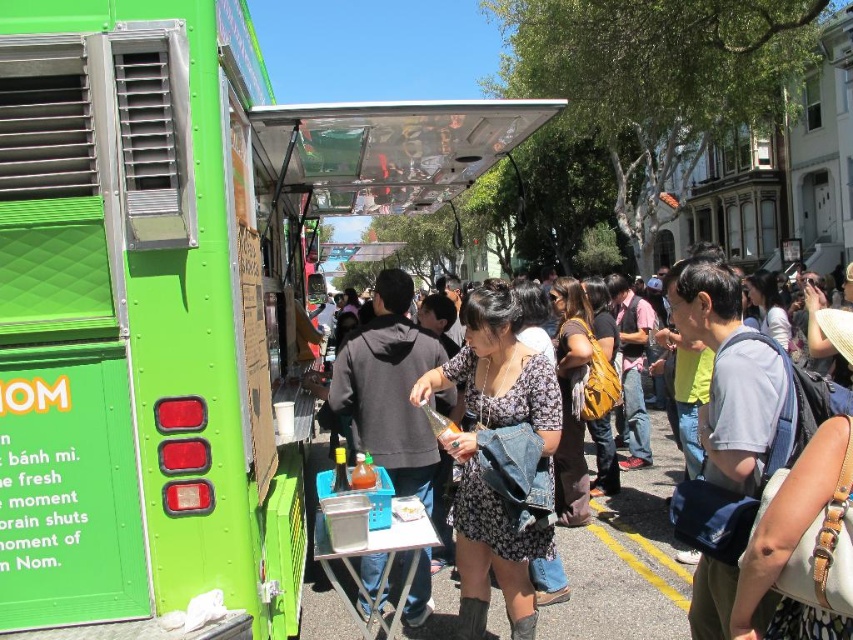
Question: Estimate the real-world distances between objects in this image. Which object is closer to the yellow painted line at lower center?

Choices:
 (A) floral-patterned dress at center
 (B) dark gray hoodie at center
 (C) green matte food truck at center
 (D) denim jacket at center

Answer: (D)

Question: Is floral-patterned dress at center in front of yellow painted line at lower center?

Choices:
 (A) yes
 (B) no

Answer: (A)

Question: Which is farther from the denim jacket at center?

Choices:
 (A) yellow painted line at lower center
 (B) floral-patterned dress at center

Answer: (B)

Question: Does denim jacket at center come in front of dark gray hoodie at center?

Choices:
 (A) yes
 (B) no

Answer: (B)

Question: Which object is positioned farthest from the yellow painted line at lower center?

Choices:
 (A) denim jacket at center
 (B) floral-patterned dress at center
 (C) dark gray hoodie at center
 (D) green matte food truck at center

Answer: (D)

Question: Does green matte food truck at center appear over yellow painted line at lower center?

Choices:
 (A) no
 (B) yes

Answer: (B)